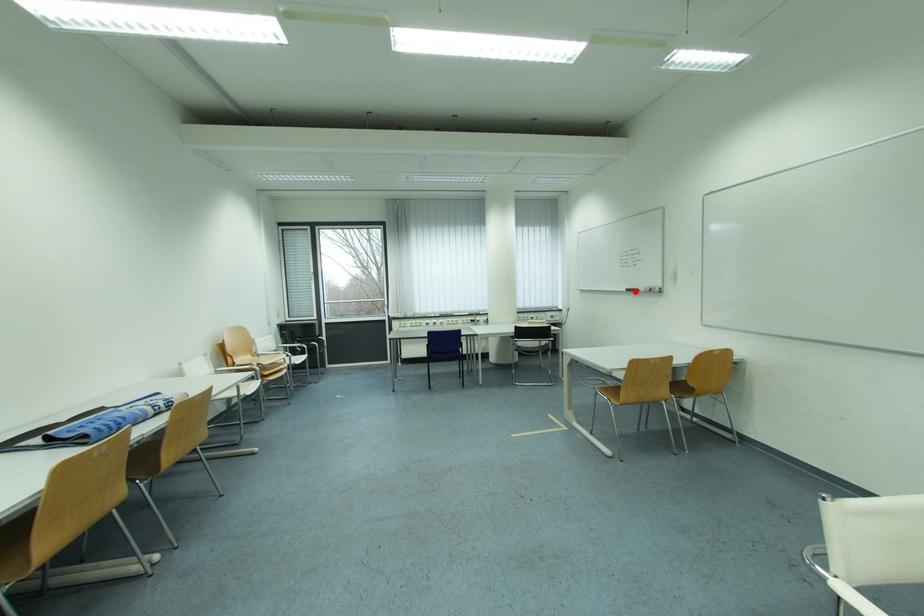
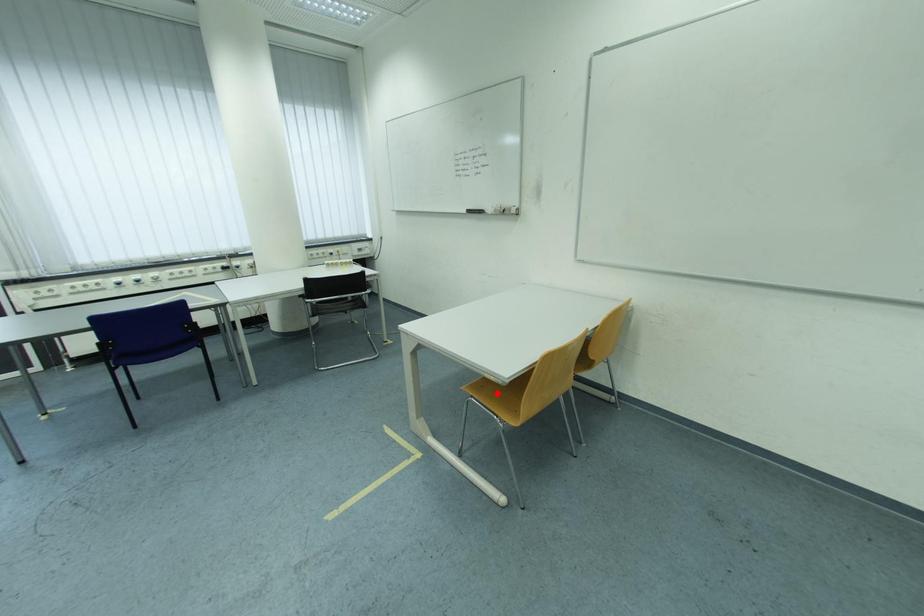
I am providing you with two images of the same scene from different viewpoints. A red point is marked on the first image and another point is marked on the second image. Are the points marked in image1 and image2 representing the same 3D position?

No